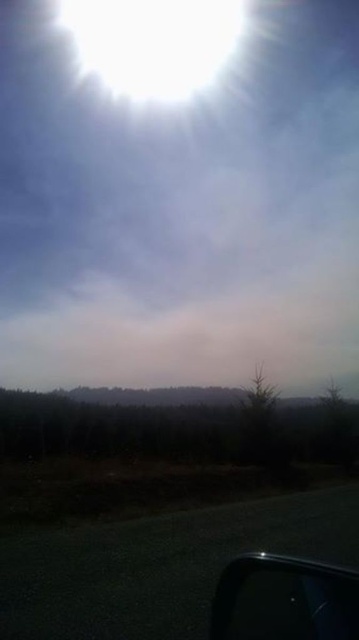
Question: Which of the following is the closest to the observer?

Choices:
 (A) (82, 538)
 (B) (147, 227)
 (C) (240, 595)

Answer: (C)

Question: Is black asphalt highway at bottom wider than transparent glass car window at lower right?

Choices:
 (A) no
 (B) yes

Answer: (B)

Question: Which object is positioned closest to the black asphalt highway at bottom?

Choices:
 (A) transparent glass car window at lower right
 (B) dense forest at lower center
 (C) white fluffy cloud at upper center
 (D) bright white cloud at upper center

Answer: (A)

Question: Is white fluffy cloud at upper center above dense forest at lower center?

Choices:
 (A) no
 (B) yes

Answer: (B)

Question: Can you confirm if white fluffy cloud at upper center is smaller than bright white cloud at upper center?

Choices:
 (A) no
 (B) yes

Answer: (A)

Question: Which of the following is the closest to the observer?

Choices:
 (A) dense forest at lower center
 (B) transparent glass car window at lower right

Answer: (B)